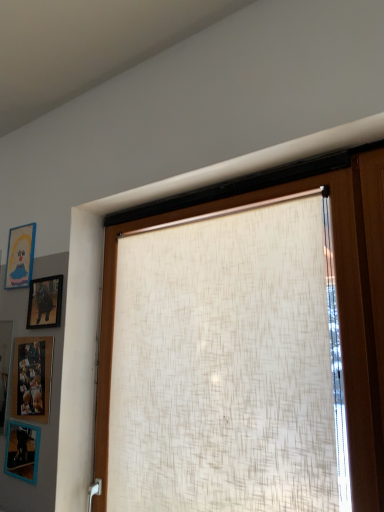
Locate an element on the screen. This screenshot has width=384, height=512. blue matte picture frame at upper left, which is the 1th picture frame in top-to-bottom order is located at coordinates (20, 256).

At what (x,y) coordinates should I click in order to perform the action: click on beige textured roller blind at center. Please return your answer as a coordinate pair (x, y). The height and width of the screenshot is (512, 384). Looking at the image, I should click on (336, 283).

Describe the element at coordinates (45, 302) in the screenshot. This screenshot has height=512, width=384. I see `matte black picture frame at upper left, the 2th picture frame positioned from the top` at that location.

Measure the distance between point (29, 297) and camera.

A distance of 2.00 meters exists between point (29, 297) and camera.

What do you see at coordinates (32, 378) in the screenshot?
I see `wooden picture frame at lower left, placed as the third picture frame when sorted from top to bottom` at bounding box center [32, 378].

Locate an element on the screen. blue matte picture frame at upper left, marked as the 4th picture frame in a bottom-to-top arrangement is located at coordinates (20, 256).

Looking at this image, does matte black picture frame at upper left, the third picture frame from the bottom, have a greater height compared to wooden picture frame at lower left, which is the second picture frame from bottom to top?

In fact, matte black picture frame at upper left, the third picture frame from the bottom, may be shorter than wooden picture frame at lower left, which is the second picture frame from bottom to top.

Based on the photo, is matte black picture frame at upper left, the 2th picture frame positioned from the top, in front of or behind wooden picture frame at lower left, placed as the third picture frame when sorted from top to bottom, in the image?

In the image, matte black picture frame at upper left, the 2th picture frame positioned from the top, appears behind wooden picture frame at lower left, placed as the third picture frame when sorted from top to bottom.

Is matte black picture frame at upper left, the 2th picture frame positioned from the top, next to wooden picture frame at lower left, placed as the third picture frame when sorted from top to bottom?

matte black picture frame at upper left, the 2th picture frame positioned from the top, and wooden picture frame at lower left, placed as the third picture frame when sorted from top to bottom, are not in contact.

From the matte black picture frame at upper left, the 2th picture frame positioned from the top, count the 1st picture frame to the left and point to it. Please provide its 2D coordinates.

[(32, 378)]

Is beige textured roller blind at center far away from wooden picture frame at lower left, which is the second picture frame from bottom to top?

They are positioned close to each other.

Looking at their sizes, would you say beige textured roller blind at center is wider or thinner than wooden picture frame at lower left, placed as the third picture frame when sorted from top to bottom?

→ beige textured roller blind at center is wider than wooden picture frame at lower left, placed as the third picture frame when sorted from top to bottom.

In the scene shown: From a real-world perspective, is beige textured roller blind at center positioned above or below wooden picture frame at lower left, placed as the third picture frame when sorted from top to bottom?

From a real-world perspective, beige textured roller blind at center is physically above wooden picture frame at lower left, placed as the third picture frame when sorted from top to bottom.

Could you measure the distance between beige textured roller blind at center and wooden picture frame at lower left, placed as the third picture frame when sorted from top to bottom?

16.27 inches.

From the image's perspective, would you say blue matte picture frame at upper left, marked as the 4th picture frame in a bottom-to-top arrangement, is shown under blue plastic picture frame at lower left, acting as the 1th picture frame starting from the bottom?

No, from the image's perspective, blue matte picture frame at upper left, marked as the 4th picture frame in a bottom-to-top arrangement, is not beneath blue plastic picture frame at lower left, acting as the 1th picture frame starting from the bottom.

Can you confirm if blue matte picture frame at upper left, which is the 1th picture frame in top-to-bottom order, is positioned to the right of blue plastic picture frame at lower left, which ranks as the 4th picture frame in top-to-bottom order?

Incorrect, blue matte picture frame at upper left, which is the 1th picture frame in top-to-bottom order, is not on the right side of blue plastic picture frame at lower left, which ranks as the 4th picture frame in top-to-bottom order.

Does blue matte picture frame at upper left, which is the 1th picture frame in top-to-bottom order, contain blue plastic picture frame at lower left, acting as the 1th picture frame starting from the bottom?

No, blue plastic picture frame at lower left, acting as the 1th picture frame starting from the bottom, is not a part of blue matte picture frame at upper left, which is the 1th picture frame in top-to-bottom order.

Considering the sizes of objects blue matte picture frame at upper left, which is the 1th picture frame in top-to-bottom order, and blue plastic picture frame at lower left, acting as the 1th picture frame starting from the bottom, in the image provided, who is bigger, blue matte picture frame at upper left, which is the 1th picture frame in top-to-bottom order, or blue plastic picture frame at lower left, acting as the 1th picture frame starting from the bottom,?

With larger size is blue plastic picture frame at lower left, acting as the 1th picture frame starting from the bottom.

Is matte black picture frame at upper left, the third picture frame from the bottom, bigger than blue matte picture frame at upper left, marked as the 4th picture frame in a bottom-to-top arrangement?

Indeed, matte black picture frame at upper left, the third picture frame from the bottom, has a larger size compared to blue matte picture frame at upper left, marked as the 4th picture frame in a bottom-to-top arrangement.

Which of these two, matte black picture frame at upper left, the third picture frame from the bottom, or blue matte picture frame at upper left, which is the 1th picture frame in top-to-bottom order, is wider?

With larger width is matte black picture frame at upper left, the third picture frame from the bottom.

From the image's perspective, which is above, matte black picture frame at upper left, the 2th picture frame positioned from the top, or blue matte picture frame at upper left, marked as the 4th picture frame in a bottom-to-top arrangement?

blue matte picture frame at upper left, marked as the 4th picture frame in a bottom-to-top arrangement, is shown above in the image.

Which picture frame is the 1st one when counting from the front of the blue matte picture frame at upper left, marked as the 4th picture frame in a bottom-to-top arrangement? Please provide its 2D coordinates.

[(45, 302)]

Which is nearer, (24, 285) or (35, 402)?

Point (35, 402)

Is blue matte picture frame at upper left, which is the 1th picture frame in top-to-bottom order, turned away from wooden picture frame at lower left, which is the second picture frame from bottom to top?

No, blue matte picture frame at upper left, which is the 1th picture frame in top-to-bottom order, is not facing the opposite direction of wooden picture frame at lower left, which is the second picture frame from bottom to top.

Would you say blue matte picture frame at upper left, marked as the 4th picture frame in a bottom-to-top arrangement, is a long distance from wooden picture frame at lower left, placed as the third picture frame when sorted from top to bottom?

They are positioned close to each other.

The height and width of the screenshot is (512, 384). In order to click on the 2nd picture frame positioned below the blue matte picture frame at upper left, marked as the 4th picture frame in a bottom-to-top arrangement (from the image's perspective) in this screenshot , I will do `click(32, 378)`.

Is blue plastic picture frame at lower left, which ranks as the 4th picture frame in top-to-bottom order, facing away from beige textured roller blind at center?

No.

Is blue plastic picture frame at lower left, acting as the 1th picture frame starting from the bottom, to the right of beige textured roller blind at center from the viewer's perspective?

No.

Is blue plastic picture frame at lower left, which ranks as the 4th picture frame in top-to-bottom order, with beige textured roller blind at center?

No.

Based on the photo, from the image's perspective, between matte black picture frame at upper left, the 2th picture frame positioned from the top, and blue plastic picture frame at lower left, acting as the 1th picture frame starting from the bottom, which one is located above?

matte black picture frame at upper left, the 2th picture frame positioned from the top, from the image's perspective.

Would you say blue plastic picture frame at lower left, which ranks as the 4th picture frame in top-to-bottom order, is part of matte black picture frame at upper left, the third picture frame from the bottom,'s contents?

Definitely not — blue plastic picture frame at lower left, which ranks as the 4th picture frame in top-to-bottom order, is not inside matte black picture frame at upper left, the third picture frame from the bottom.

Which object is more forward, matte black picture frame at upper left, the third picture frame from the bottom, or blue plastic picture frame at lower left, acting as the 1th picture frame starting from the bottom?

blue plastic picture frame at lower left, acting as the 1th picture frame starting from the bottom, is more forward.

Is matte black picture frame at upper left, the 2th picture frame positioned from the top, bigger than blue plastic picture frame at lower left, which ranks as the 4th picture frame in top-to-bottom order?

Incorrect, matte black picture frame at upper left, the 2th picture frame positioned from the top, is not larger than blue plastic picture frame at lower left, which ranks as the 4th picture frame in top-to-bottom order.

At what (x,y) coordinates should I click in order to perform the action: click on the 1st picture frame below the matte black picture frame at upper left, the 2th picture frame positioned from the top (from a real-world perspective). Please return your answer as a coordinate pair (x, y). The image size is (384, 512). Looking at the image, I should click on point(32,378).

The height and width of the screenshot is (512, 384). Identify the location of window that appears in front of the wooden picture frame at lower left, which is the second picture frame from bottom to top. (336, 283).

Estimate the real-world distances between objects in this image. Which object is further from blue matte picture frame at upper left, marked as the 4th picture frame in a bottom-to-top arrangement, beige textured roller blind at center or wooden picture frame at lower left, which is the second picture frame from bottom to top?

The object further to blue matte picture frame at upper left, marked as the 4th picture frame in a bottom-to-top arrangement, is beige textured roller blind at center.

From the image, which object appears to be farther from beige textured roller blind at center, blue matte picture frame at upper left, marked as the 4th picture frame in a bottom-to-top arrangement, or wooden picture frame at lower left, which is the second picture frame from bottom to top?

Among the two, blue matte picture frame at upper left, marked as the 4th picture frame in a bottom-to-top arrangement, is located further to beige textured roller blind at center.

From the image, which object appears to be nearer to blue matte picture frame at upper left, which is the 1th picture frame in top-to-bottom order, blue plastic picture frame at lower left, which ranks as the 4th picture frame in top-to-bottom order, or matte black picture frame at upper left, the third picture frame from the bottom?

Among the two, matte black picture frame at upper left, the third picture frame from the bottom, is located nearer to blue matte picture frame at upper left, which is the 1th picture frame in top-to-bottom order.

Considering their positions, is matte black picture frame at upper left, the third picture frame from the bottom, positioned closer to wooden picture frame at lower left, which is the second picture frame from bottom to top, than beige textured roller blind at center?

matte black picture frame at upper left, the third picture frame from the bottom, is closer to wooden picture frame at lower left, which is the second picture frame from bottom to top.

In the scene shown: When comparing their distances from blue plastic picture frame at lower left, acting as the 1th picture frame starting from the bottom, does blue matte picture frame at upper left, marked as the 4th picture frame in a bottom-to-top arrangement, or wooden picture frame at lower left, which is the second picture frame from bottom to top, seem further?

blue matte picture frame at upper left, marked as the 4th picture frame in a bottom-to-top arrangement.

Estimate the real-world distances between objects in this image. Which object is further from blue matte picture frame at upper left, which is the 1th picture frame in top-to-bottom order, beige textured roller blind at center or matte black picture frame at upper left, the third picture frame from the bottom?

beige textured roller blind at center is positioned further to the anchor blue matte picture frame at upper left, which is the 1th picture frame in top-to-bottom order.

Considering their positions, is wooden picture frame at lower left, which is the second picture frame from bottom to top, positioned closer to blue matte picture frame at upper left, which is the 1th picture frame in top-to-bottom order, than blue plastic picture frame at lower left, acting as the 1th picture frame starting from the bottom?

wooden picture frame at lower left, which is the second picture frame from bottom to top, is positioned closer to the anchor blue matte picture frame at upper left, which is the 1th picture frame in top-to-bottom order.

Considering their positions, is blue plastic picture frame at lower left, acting as the 1th picture frame starting from the bottom, positioned further to wooden picture frame at lower left, placed as the third picture frame when sorted from top to bottom, than matte black picture frame at upper left, the 2th picture frame positioned from the top?

Based on the image, matte black picture frame at upper left, the 2th picture frame positioned from the top, appears to be further to wooden picture frame at lower left, placed as the third picture frame when sorted from top to bottom.

Find the location of a particular element. Image resolution: width=384 pixels, height=512 pixels. picture frame situated between wooden picture frame at lower left, which is the second picture frame from bottom to top, and beige textured roller blind at center from left to right is located at coordinates (45, 302).

You are a GUI agent. You are given a task and a screenshot of the screen. Output one action in this format:
    pyautogui.click(x=<x>, y=<y>)
    Task: Click on the picture frame between blue matte picture frame at upper left, marked as the 4th picture frame in a bottom-to-top arrangement, and wooden picture frame at lower left, which is the second picture frame from bottom to top, vertically
    
    Given the screenshot: What is the action you would take?
    pyautogui.click(x=45, y=302)

Locate an element on the screen. picture frame that lies between matte black picture frame at upper left, the 2th picture frame positioned from the top, and blue plastic picture frame at lower left, acting as the 1th picture frame starting from the bottom, from top to bottom is located at coordinates (32, 378).